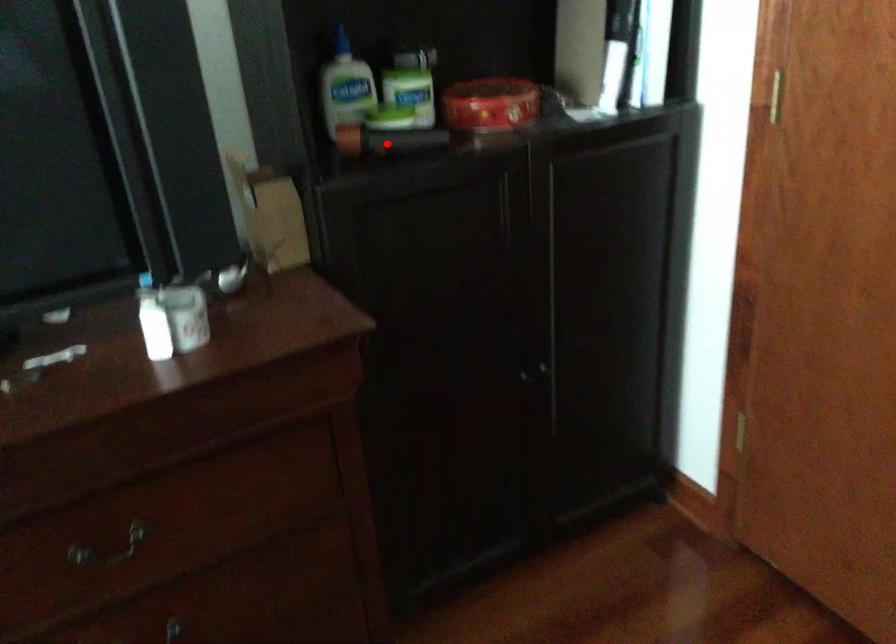
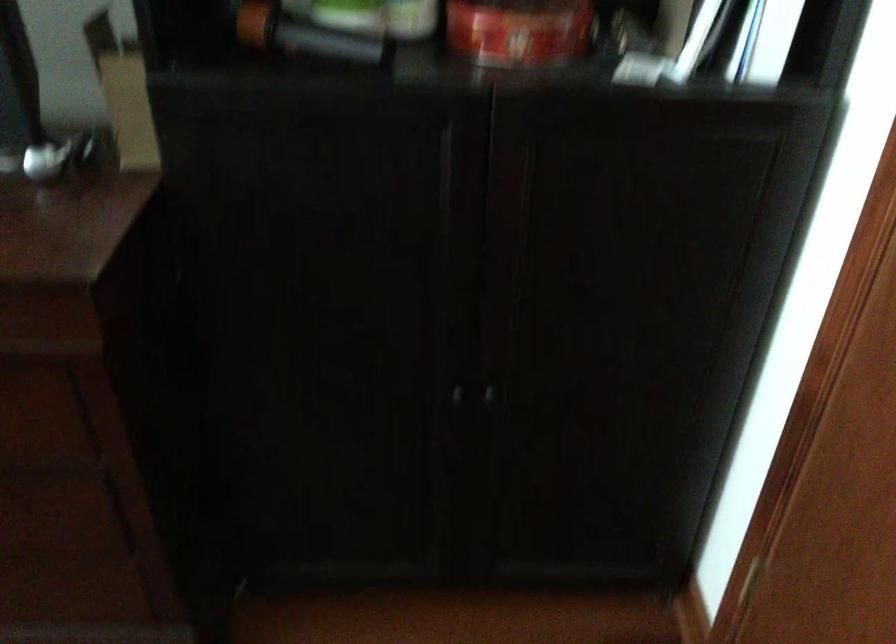
Question: A red point is marked in image1. In image2, is the corresponding 3D point closer to the camera or farther? Reply with the corresponding letter.

Choices:
 (A) The corresponding 3D point is closer.
 (B) The corresponding 3D point is farther.

Answer: (A)